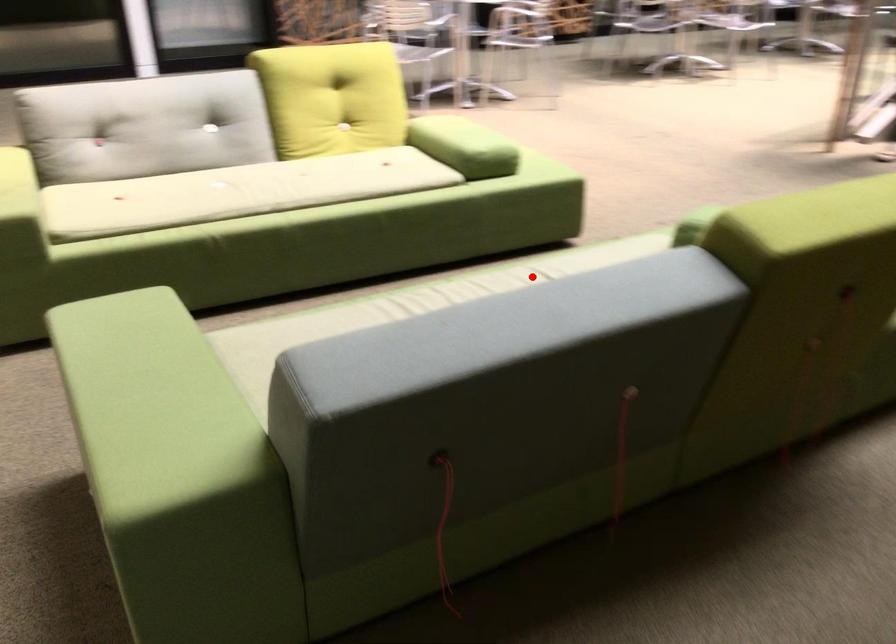
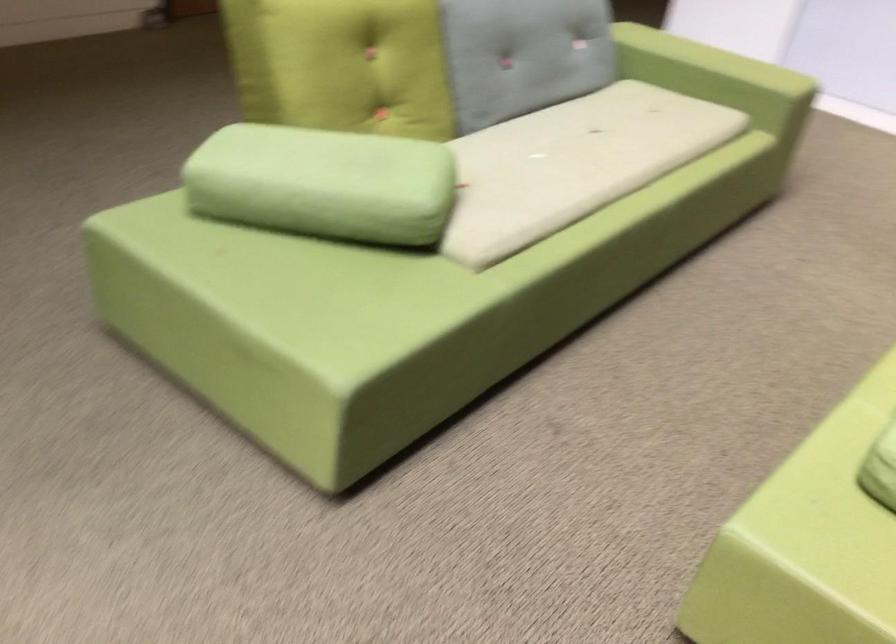
In the second image, find the point that corresponds to the highlighted location in the first image.

(572, 164)